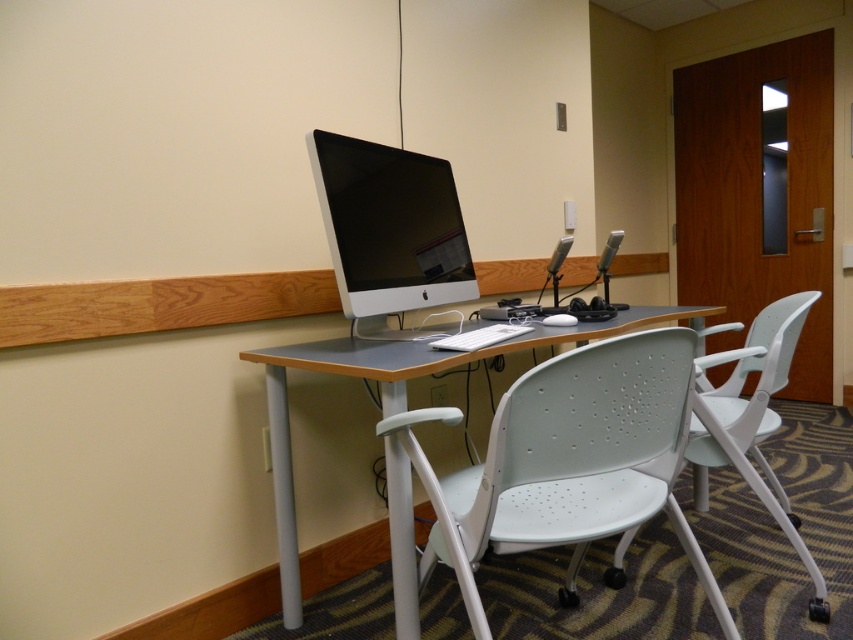
Can you confirm if matte gray desk at center is positioned to the right of white plastic chair at center?

No, matte gray desk at center is not to the right of white plastic chair at center.

Does matte gray desk at center appear on the left side of white plastic chair at center?

Yes, matte gray desk at center is to the left of white plastic chair at center.

Is point (527, 333) more distant than point (729, 442)?

Yes.

At what (x,y) coordinates should I click in order to perform the action: click on matte gray desk at center. Please return your answer as a coordinate pair (x, y). This screenshot has width=853, height=640. Looking at the image, I should click on coord(395,397).

Who is positioned more to the right, satin black monitor at center or white plastic chair at center?

From the viewer's perspective, white plastic chair at center appears more on the right side.

Is satin black monitor at center shorter than white plastic chair at center?

Correct, satin black monitor at center is not as tall as white plastic chair at center.

Locate an element on the screen. The image size is (853, 640). satin black monitor at center is located at coordinates (389, 228).

Is point (451, 301) closer to viewer compared to point (404, 506)?

No, (451, 301) is further to viewer.

Where is `satin black monitor at center`? satin black monitor at center is located at coordinates (389, 228).

You are a GUI agent. You are given a task and a screenshot of the screen. Output one action in this format:
    pyautogui.click(x=<x>, y=<y>)
    Task: Click on the satin black monitor at center
    The width and height of the screenshot is (853, 640).
    Given the screenshot: What is the action you would take?
    pyautogui.click(x=389, y=228)